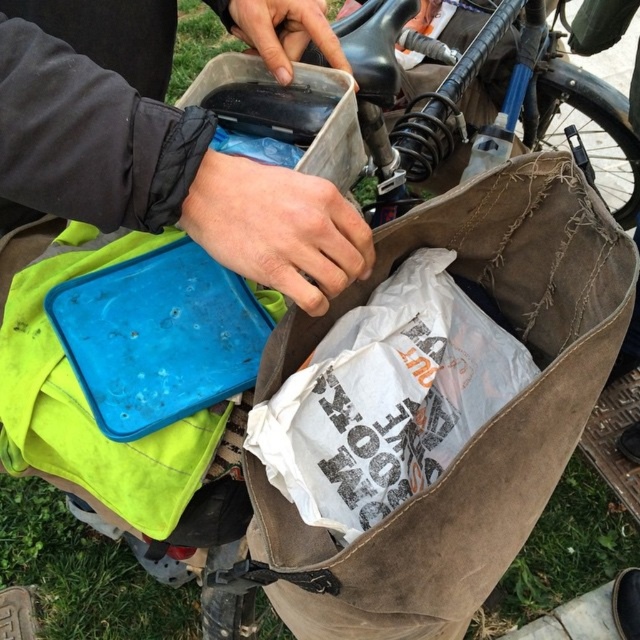
Question: Can you confirm if brown canvas bag at center is positioned to the right of matte plastic container at upper center?

Choices:
 (A) yes
 (B) no

Answer: (A)

Question: Does brown canvas bag at center appear on the left side of matte plastic container at upper center?

Choices:
 (A) no
 (B) yes

Answer: (A)

Question: Which point is closer to the camera?

Choices:
 (A) (376, 636)
 (B) (100, 225)

Answer: (B)

Question: Which point is farther from the camera taking this photo?

Choices:
 (A) (204, 122)
 (B) (618, 308)

Answer: (B)

Question: Can you confirm if brown canvas bag at center is positioned above matte plastic container at upper center?

Choices:
 (A) no
 (B) yes

Answer: (A)